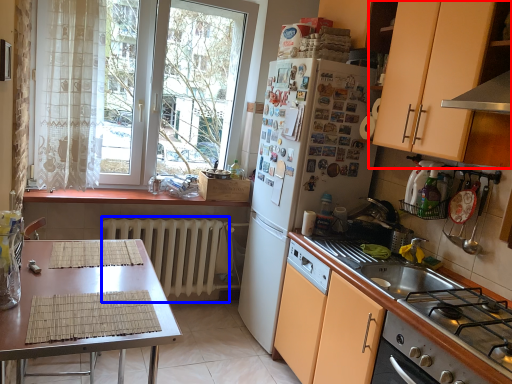
Question: Which object is closer to the camera taking this photo, cabinetry (highlighted by a red box) or radiator (highlighted by a blue box)?

Choices:
 (A) cabinetry
 (B) radiator

Answer: (A)